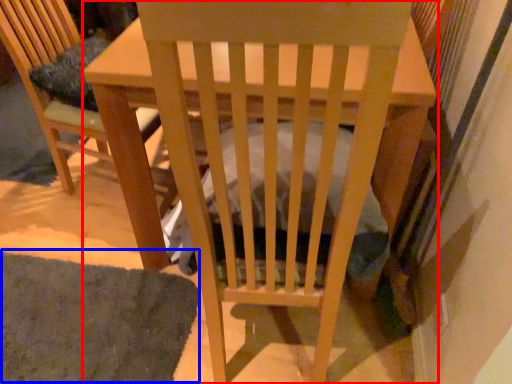
Question: Among these objects, which one is nearest to the camera, table (highlighted by a red box) or mat (highlighted by a blue box)?

Choices:
 (A) table
 (B) mat

Answer: (A)